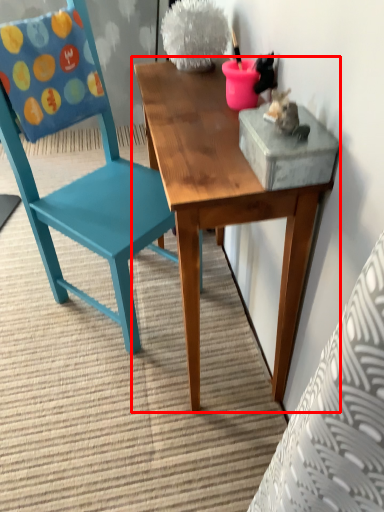
Question: From the image's perspective, where is table (annotated by the red box) located in relation to chair in the image?

Choices:
 (A) above
 (B) below

Answer: (B)